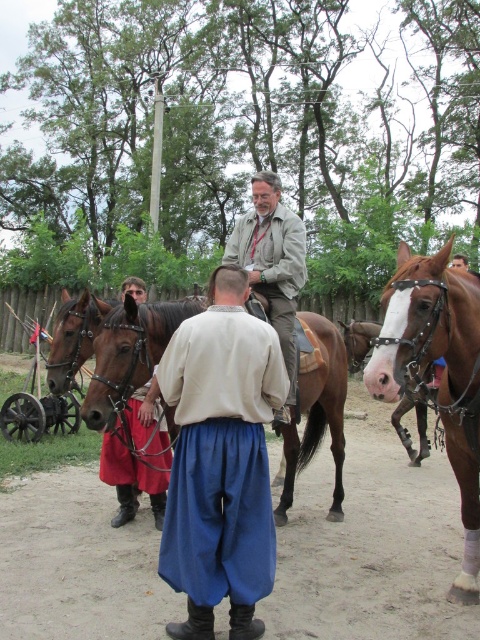
Question: Is blue cotton robe at center thinner than brown leather horse at center?

Choices:
 (A) yes
 (B) no

Answer: (A)

Question: Among these points, which one is nearest to the camera?

Choices:
 (A) 477,349
 (B) 207,308

Answer: (A)

Question: Does blue cotton robe at center appear on the left side of brown leather horse at center?

Choices:
 (A) yes
 (B) no

Answer: (A)

Question: Does blue cotton robe at center appear on the right side of brown leather horse at center?

Choices:
 (A) no
 (B) yes

Answer: (A)

Question: Estimate the real-world distances between objects in this image. Which object is closer to the brown leather horse at center?

Choices:
 (A) light brown leather jacket at center
 (B) blue cotton robe at center
 (C) brown glossy horse at center

Answer: (C)

Question: Which point appears farthest from the camera in this image?

Choices:
 (A) (445, 262)
 (B) (104, 369)
 (C) (178, 340)

Answer: (B)